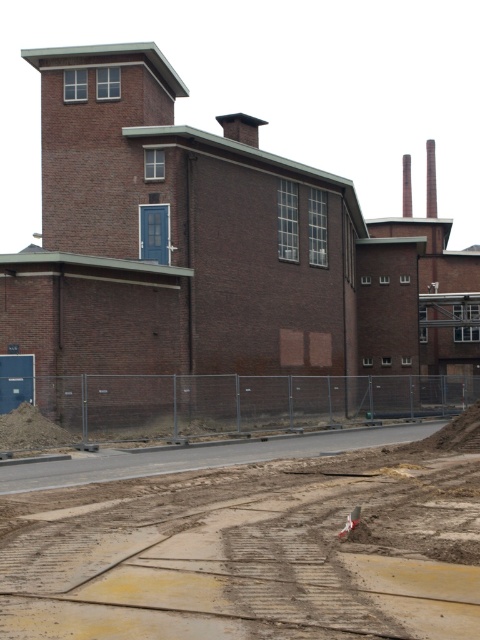
You are a delivery driver approaching the brown brick building at center and the brown dirt track at lower center. Which one should you avoid driving over to reach the building safely?

You should avoid driving over the brown dirt track at lower center because the brown brick building at center is to the right of it, so the dirt track is likely on the path towards the building and may be unstable due to construction materials.

You are standing on the sidewalk across the street from the brown brick building at center. You want to cross the street to reach it. If the street is 20 meters wide, can you safely cross without needing to walk further?

The brown brick building at center is 24.94 meters away from the viewer. Since the street is 20 meters wide, you would need to walk an additional 4.94 meters beyond the street to reach the building.

You are a delivery driver approaching the brown brick building at center and the brown dirt track at lower center. Which one will you reach first?

The brown dirt track at lower center will be reached first because it is closer to the road than the brown brick building at center.